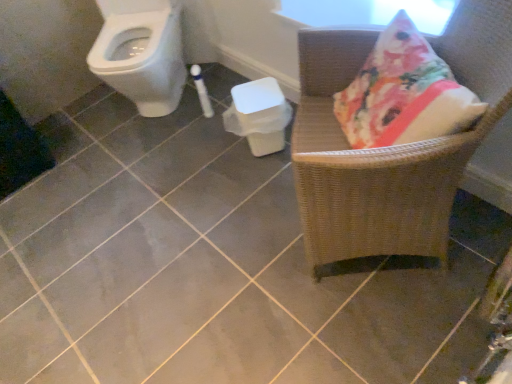
Where is `vacant region below white plastic potty at center (from a real-world perspective)`? This screenshot has height=384, width=512. vacant region below white plastic potty at center (from a real-world perspective) is located at coordinates (250, 150).